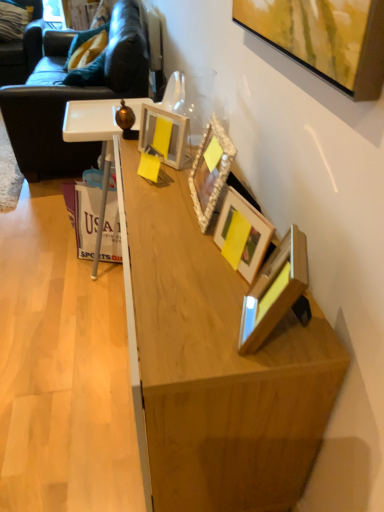
This screenshot has width=384, height=512. I want to click on free location to the right of wooden picture frame at lower right, which appears as the fourth picture frame when viewed from the back, so click(x=325, y=330).